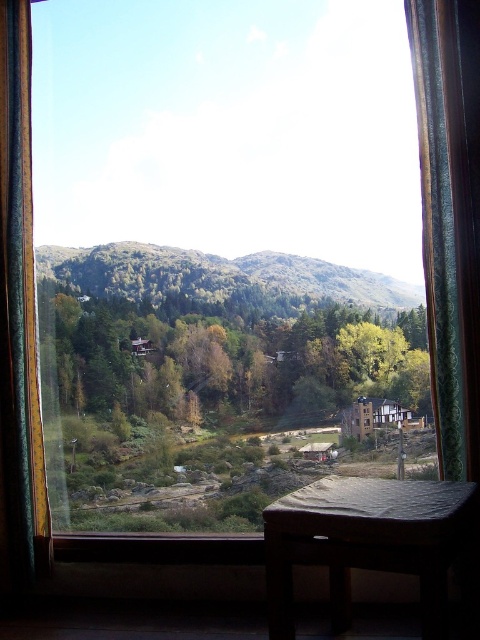
You are an interior designer assessing the space. You need to determine if there is enough room to place a large decorative item between the green textured curtain at right and the wooden cushioned chair at lower center. Based on their spatial relationship, can you confirm if this is feasible?

The green textured curtain at right occupies less space than the wooden cushioned chair at lower center, so there might be sufficient space between them to place a large decorative item.